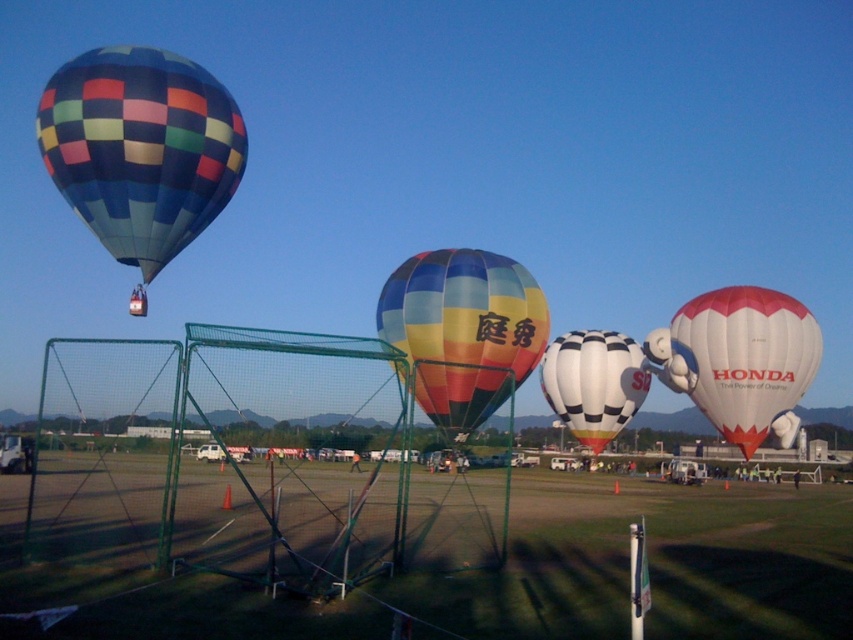
You are standing at the soccer goal and want to walk towards the point marked as point [305,621]. Will you pass by point [386,333] before reaching your destination?

Since point [305,621] is in front of point [386,333], you will reach point [305,621] before passing point [386,333]. Therefore, you will not pass by point [386,333] before reaching your destination.